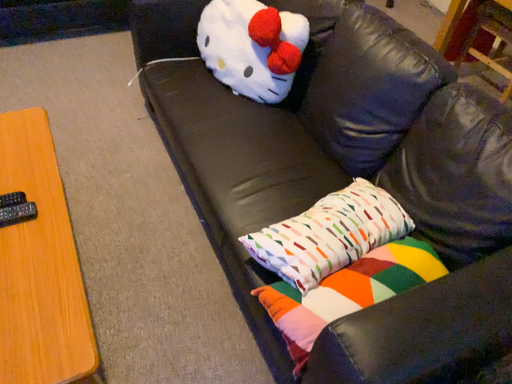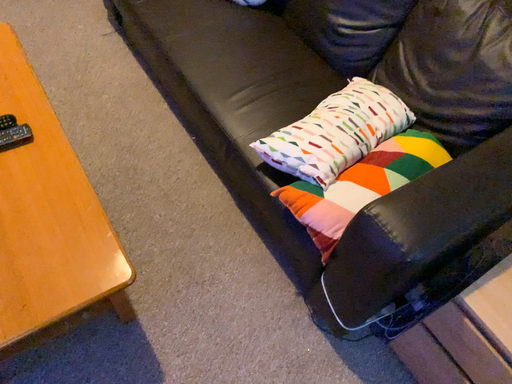
Question: How did the camera likely rotate when shooting the video?

Choices:
 (A) rotated right
 (B) rotated left

Answer: (A)